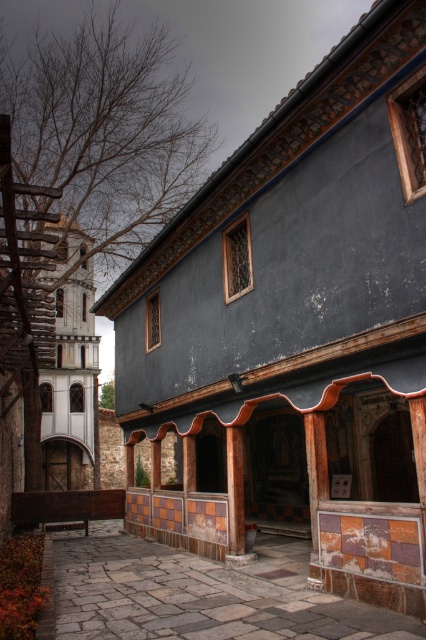
You are standing at the entrance of the historic building and want to take a photo of the point marked at coordinates point (236, 616). If your camera has a maximum focus range of 7 meters, will you be able to capture the point clearly?

The distance of point (236, 616) from viewer is 7.30 meters, which exceeds the camera maximum focus range of 7 meters. Therefore, you will not be able to capture the point clearly.